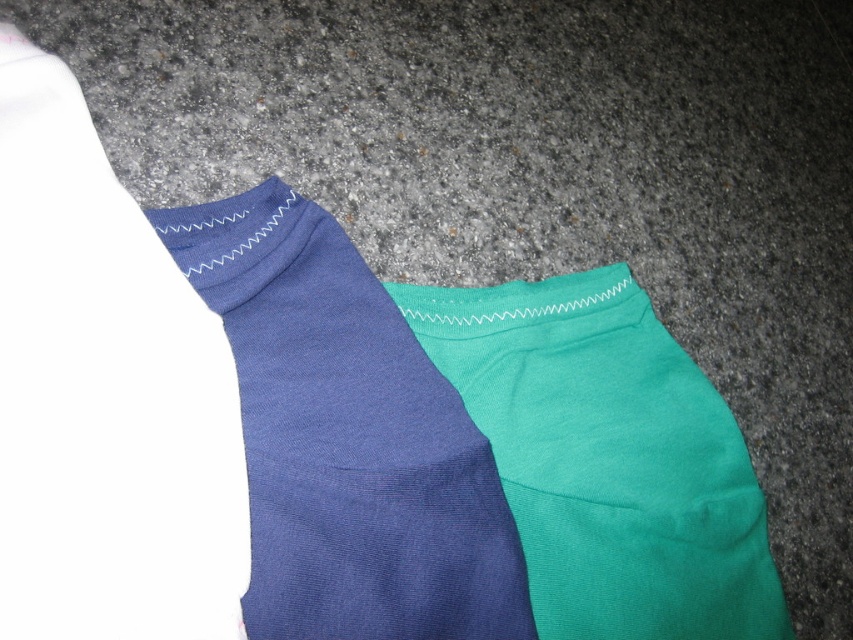
Question: Does matte blue socks at center have a greater width compared to teal smooth shorts at center?

Choices:
 (A) yes
 (B) no

Answer: (B)

Question: Can you confirm if matte blue socks at center is positioned to the right of teal smooth shorts at center?

Choices:
 (A) yes
 (B) no

Answer: (B)

Question: Is matte blue socks at center closer to camera compared to teal smooth shorts at center?

Choices:
 (A) yes
 (B) no

Answer: (A)

Question: Among these points, which one is nearest to the camera?

Choices:
 (A) (791, 627)
 (B) (465, 422)

Answer: (B)

Question: Which point is closer to the camera?

Choices:
 (A) (645, 522)
 (B) (340, 456)

Answer: (B)